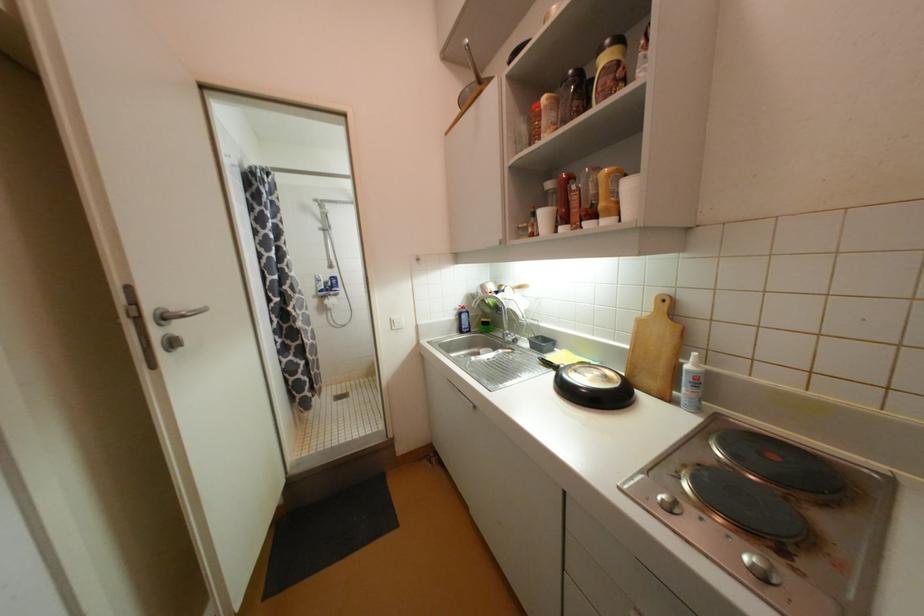
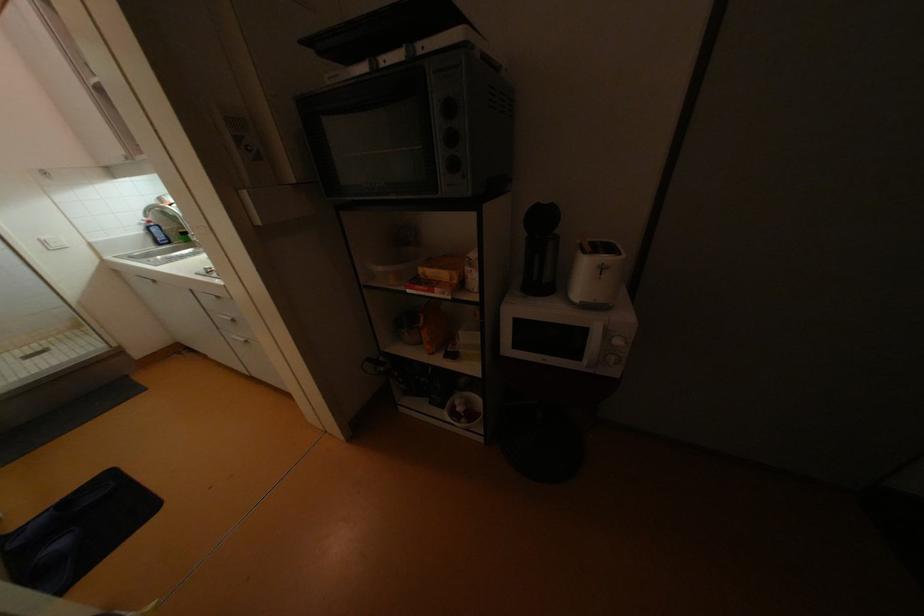
Find the pixel in the second image that matches pixel 396 323 in the first image.

(49, 243)